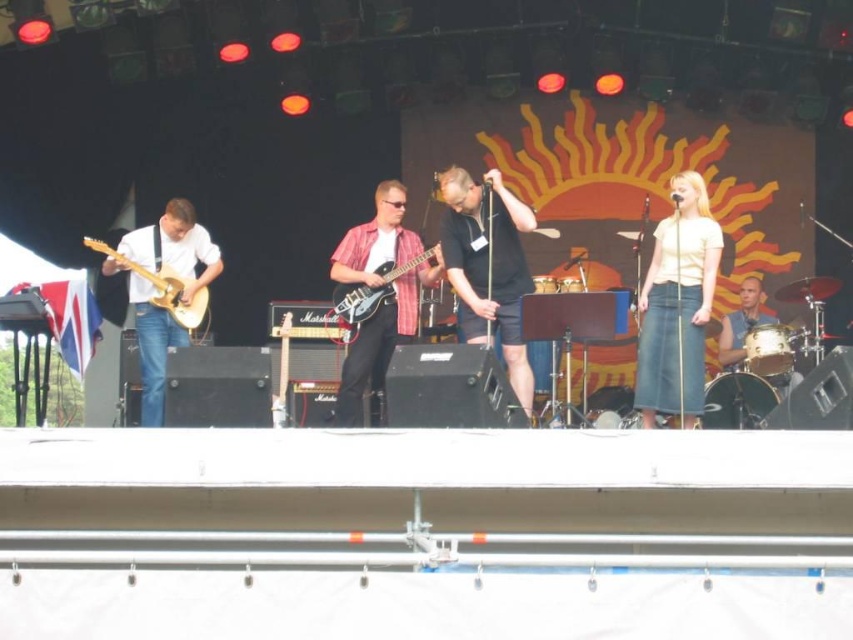
Does point (648, 388) come closer to viewer compared to point (368, 387)?

Yes.

In the scene shown: Does white denim skirt at right have a smaller size compared to plaid shirt guitar at center?

Yes.

Between point (648, 289) and point (340, 424), which one is positioned in front?

Point (340, 424) is more forward.

At what (x,y) coordinates should I click in order to perform the action: click on white denim skirt at right. Please return your answer as a coordinate pair (x, y). Looking at the image, I should click on (677, 305).

Which is more to the left, matte black guitar at left or shiny silver drum at right?

matte black guitar at left

Does point (672, 177) lie in front of point (782, 337)?

That is False.

Locate an element on the screen. The image size is (853, 640). matte black guitar at left is located at coordinates (466, 268).

Is white denim skirt at right wider than light brown wood electric guitar at left?

Correct, the width of white denim skirt at right exceeds that of light brown wood electric guitar at left.

Who is positioned more to the left, white denim skirt at right or light brown wood electric guitar at left?

light brown wood electric guitar at left

You are a GUI agent. You are given a task and a screenshot of the screen. Output one action in this format:
    pyautogui.click(x=<x>, y=<y>)
    Task: Click on the white denim skirt at right
    
    Given the screenshot: What is the action you would take?
    pyautogui.click(x=677, y=305)